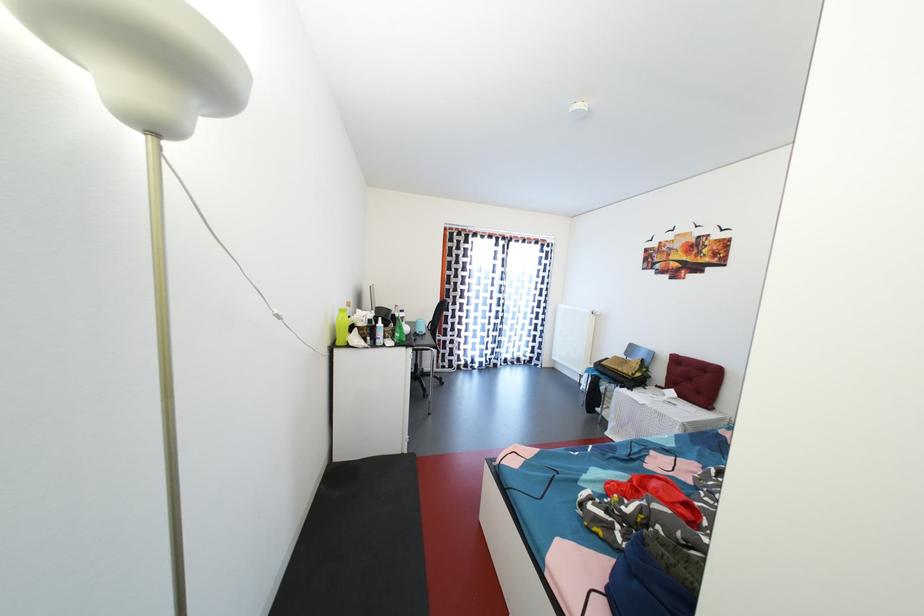
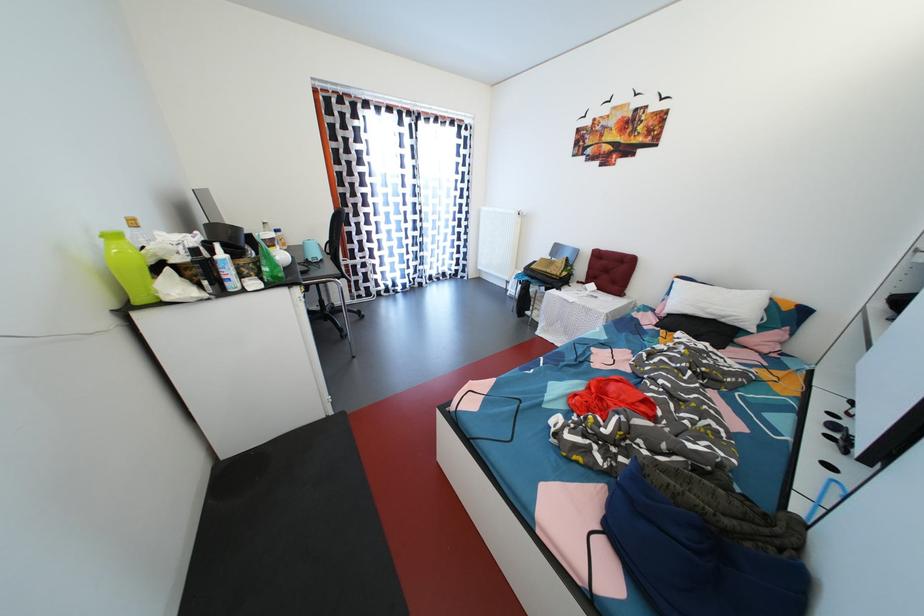
Based on the photo, how did the camera likely rotate?

The camera's rotation is toward right-down.